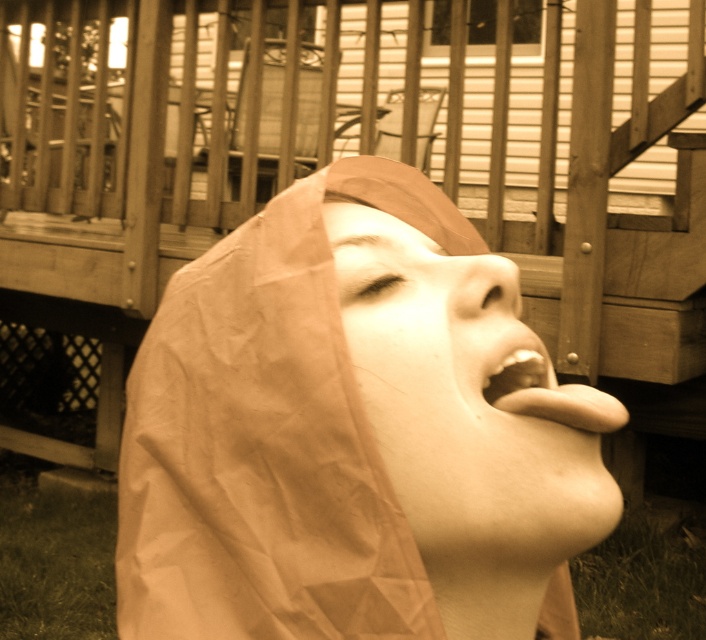
Question: Which object is closer to the camera taking this photo?

Choices:
 (A) matte paper mask at center
 (B) shiny metallic teeth at lower right
 (C) matte brown paper at lower center
 (D) brown paper bag at center

Answer: (D)

Question: Does shiny metallic teeth at lower right have a lesser width compared to matte brown paper at lower center?

Choices:
 (A) yes
 (B) no

Answer: (B)

Question: Which point appears farthest from the camera in this image?

Choices:
 (A) (359, 410)
 (B) (526, 490)
 (C) (546, 365)
 (D) (505, 358)

Answer: (C)

Question: Can you confirm if brown paper bag at center is positioned above matte brown paper at lower center?

Choices:
 (A) yes
 (B) no

Answer: (B)

Question: Does matte paper mask at center have a greater width compared to shiny metallic teeth at lower right?

Choices:
 (A) no
 (B) yes

Answer: (B)

Question: Based on their relative distances, which object is farther from the matte paper mask at center?

Choices:
 (A) shiny metallic teeth at lower right
 (B) brown paper bag at center
 (C) matte brown paper at lower center

Answer: (C)